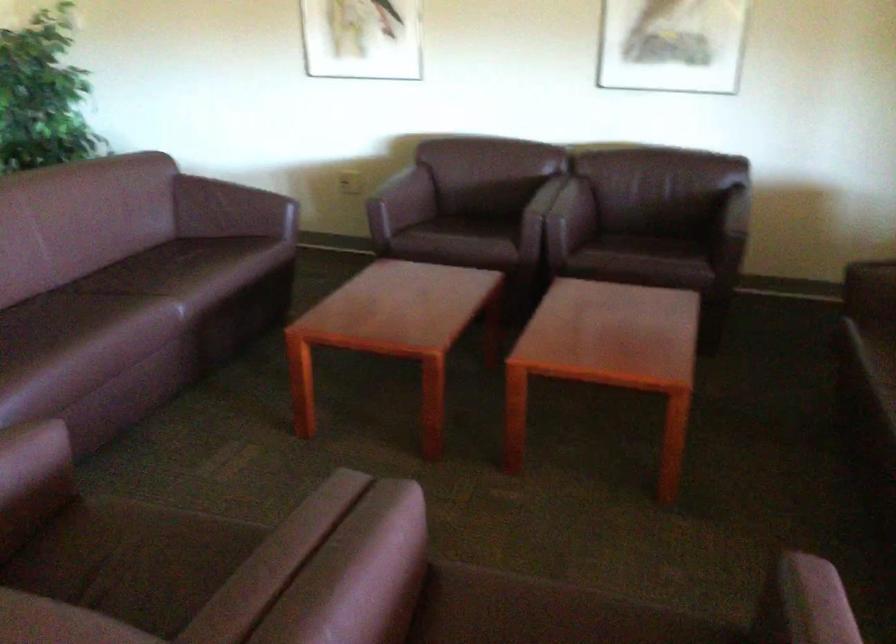
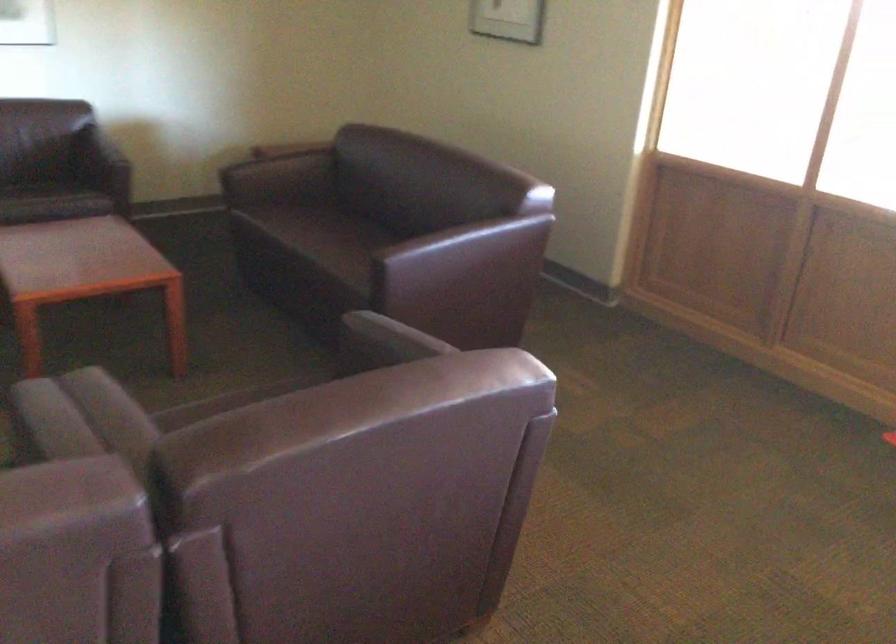
Question: How did the camera likely rotate?

Choices:
 (A) Left
 (B) Right
 (C) Up
 (D) Down

Answer: (B)